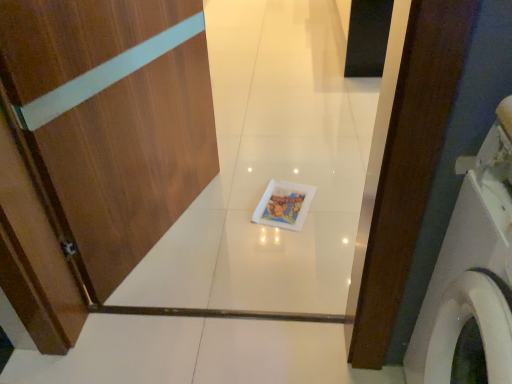
Where is `vacant region below wooden door at center (from a real-world perspective)`? The width and height of the screenshot is (512, 384). vacant region below wooden door at center (from a real-world perspective) is located at coordinates (173, 227).